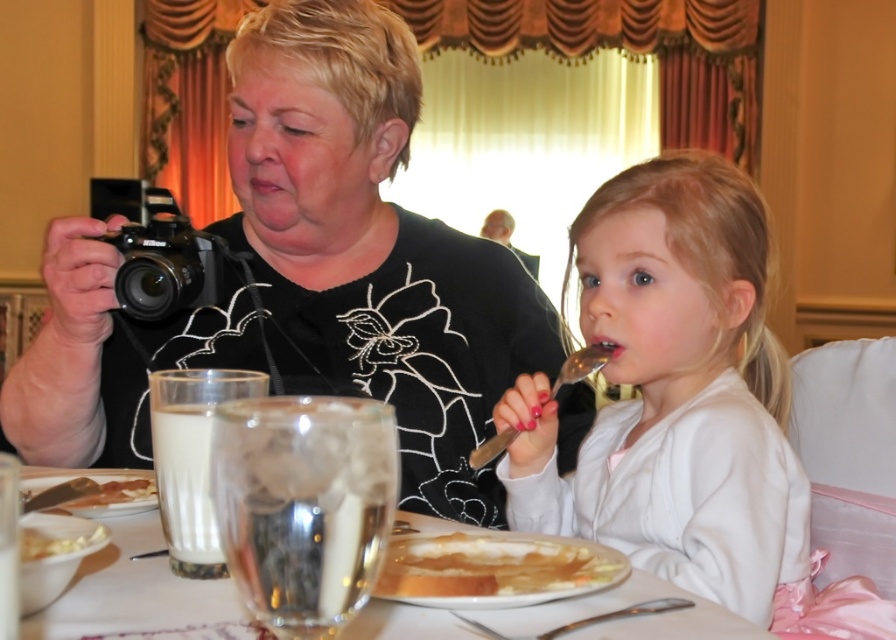
Question: Which point is farther to the camera?

Choices:
 (A) metallic silver spoon at upper center
 (B) smooth white shirt at center
 (C) smooth white plate at lower center
 (D) black plastic camera at left

Answer: (D)

Question: Can you confirm if smooth white plate at lower center is positioned to the right of white creamy food at lower left?

Choices:
 (A) no
 (B) yes

Answer: (B)

Question: Which object is positioned farthest from the white creamy food at lower left?

Choices:
 (A) black plastic camera at left
 (B) smooth white shirt at center
 (C) smooth white plate at lower center

Answer: (A)

Question: Can you confirm if white opaque glass at lower left is positioned above white creamy food at lower left?

Choices:
 (A) yes
 (B) no

Answer: (A)

Question: Is smooth white shirt at center smaller than smooth white plate at lower center?

Choices:
 (A) no
 (B) yes

Answer: (A)

Question: Estimate the real-world distances between objects in this image. Which object is farther from the black matte camera at upper left?

Choices:
 (A) smooth brown bread at lower left
 (B) black plastic camera at left
 (C) metallic silver spoon at upper center
 (D) smooth white plate at lower center

Answer: (B)